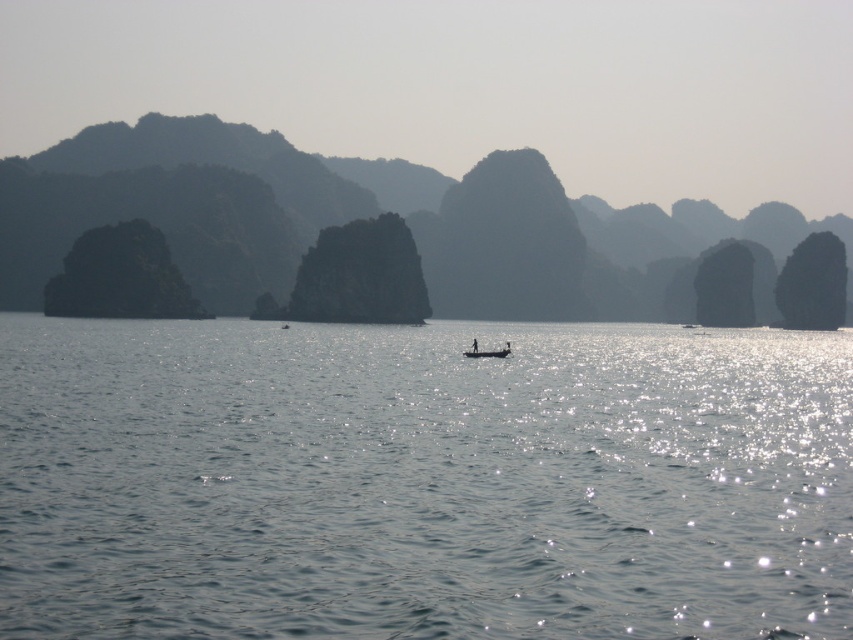
Question: Is clear water at center to the right of wooden boat at center from the viewer's perspective?

Choices:
 (A) no
 (B) yes

Answer: (B)

Question: Which point is farther to the camera?

Choices:
 (A) (421, 433)
 (B) (473, 340)

Answer: (B)

Question: Which point appears farthest from the camera in this image?

Choices:
 (A) (503, 344)
 (B) (587, 602)

Answer: (A)

Question: Can you confirm if clear water at center is positioned below wooden boat at center?

Choices:
 (A) yes
 (B) no

Answer: (A)

Question: Where is clear water at center located in relation to wooden boat at center in the image?

Choices:
 (A) right
 (B) left

Answer: (A)